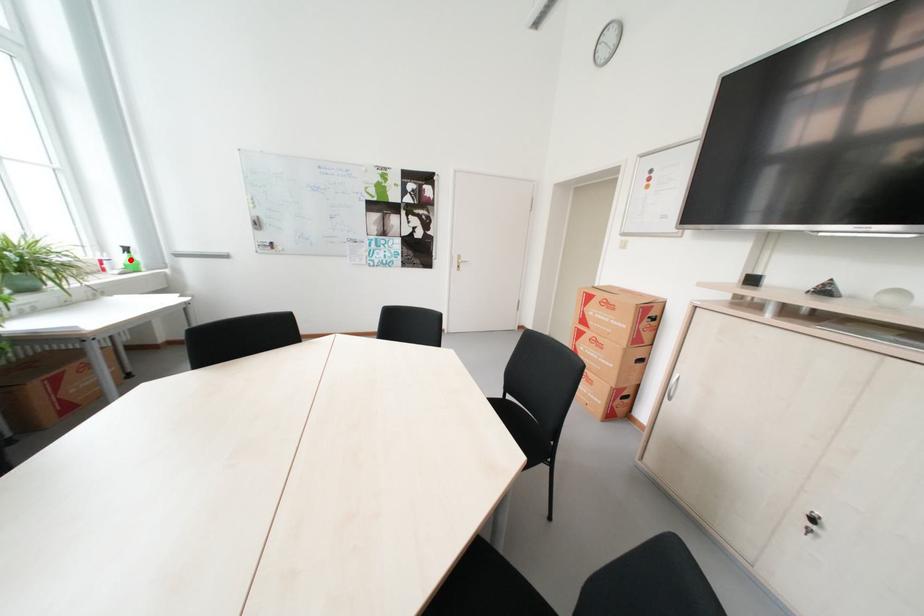
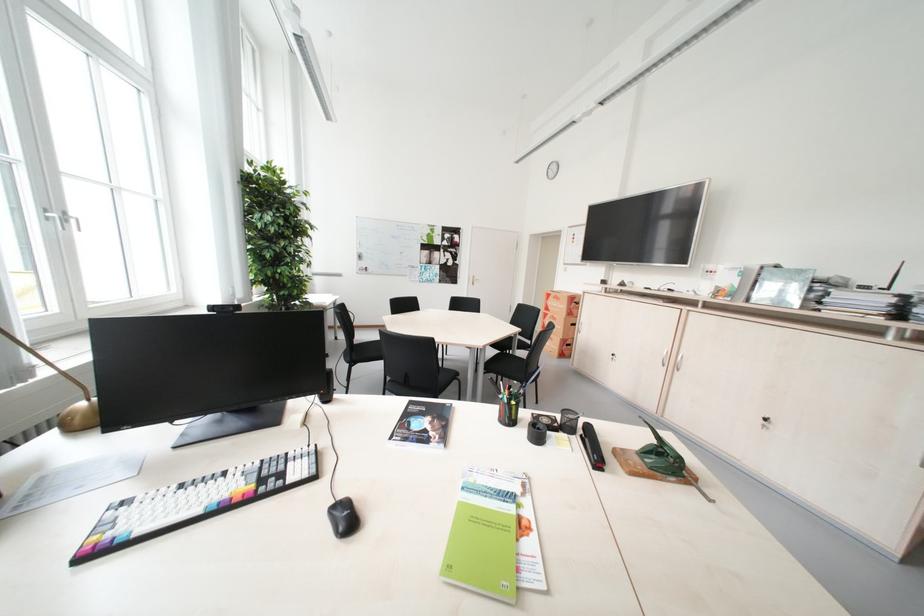
Question: I am providing you with two images of the same scene from different viewpoints. A red point is marked on the first image. At the location where the point appears in image 1, is it still visible in image 2?

Choices:
 (A) Yes
 (B) No

Answer: (B)